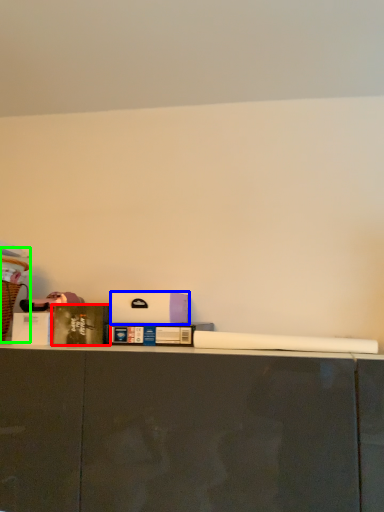
Question: Which object is the farthest from book (highlighted by a red box)? Choose among these: box (highlighted by a blue box) or laundry basket (highlighted by a green box).

Choices:
 (A) box
 (B) laundry basket

Answer: (B)